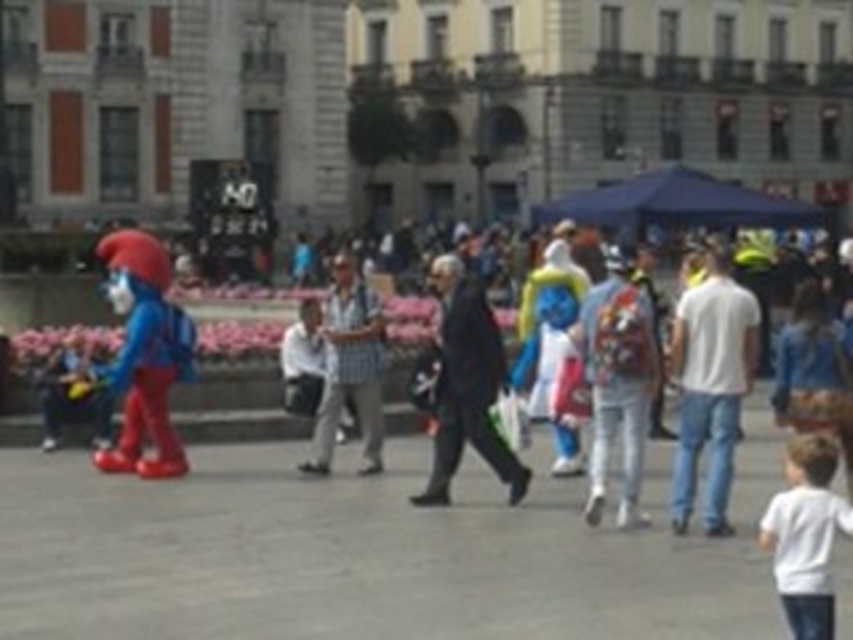
You are a photographer trying to capture both the white matte shirt at lower right and the checkered fabric shirt at center in a single shot. Given their sizes, which shirt will appear larger in the photo?

The checkered fabric shirt at center will appear larger in the photo because it is larger than the white matte shirt at lower right.